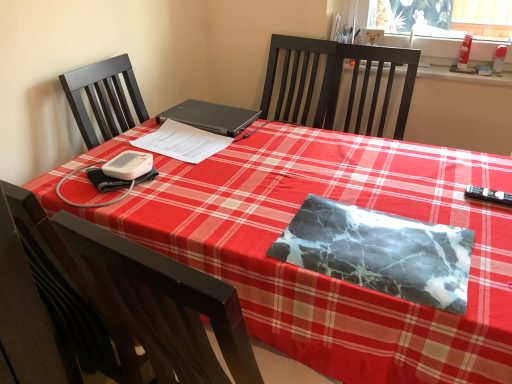
Question: From a real-world perspective, is black plastic remote control at right above or below white paper at center, arranged as the 2th notebook when viewed from the front?

Choices:
 (A) below
 (B) above

Answer: (A)

Question: In terms of size, does black plastic remote control at right appear bigger or smaller than white paper at center, arranged as the 2th notebook when viewed from the front?

Choices:
 (A) small
 (B) big

Answer: (A)

Question: Based on their relative distances, which object is nearer to the marble-patterned notebook at center, marked as the second notebook in a left-to-right arrangement?

Choices:
 (A) black matte laptop at center
 (B) black plastic remote control at right
 (C) white paper at center, which is the second notebook from right to left
 (D) dark wood chair at lower left

Answer: (B)

Question: Considering the real-world distances, which object is farthest from the dark wood chair at lower left?

Choices:
 (A) black plastic remote control at right
 (B) white paper at center, which appears as the first notebook when viewed from the left
 (C) marble-patterned notebook at center, placed as the 1th notebook when sorted from right to left
 (D) black matte laptop at center

Answer: (A)